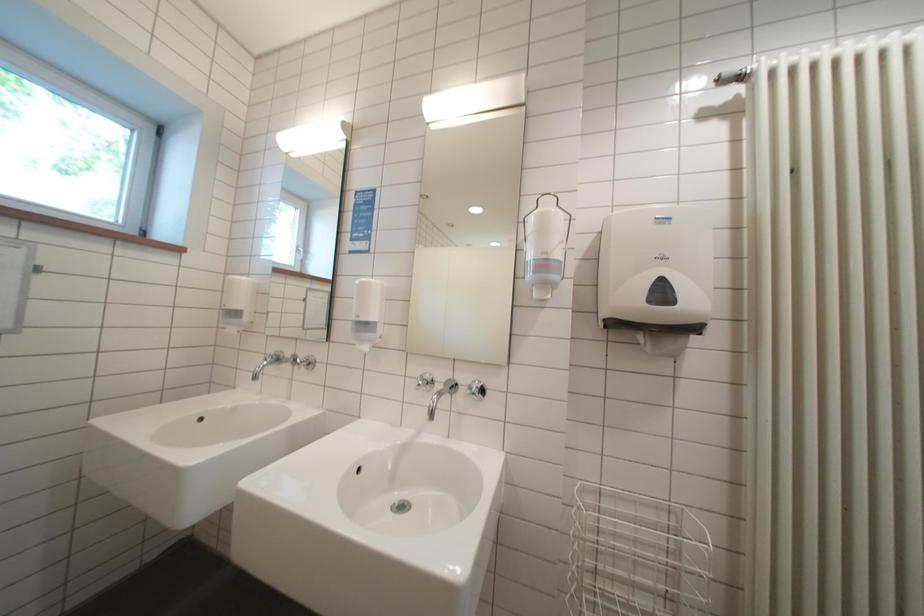
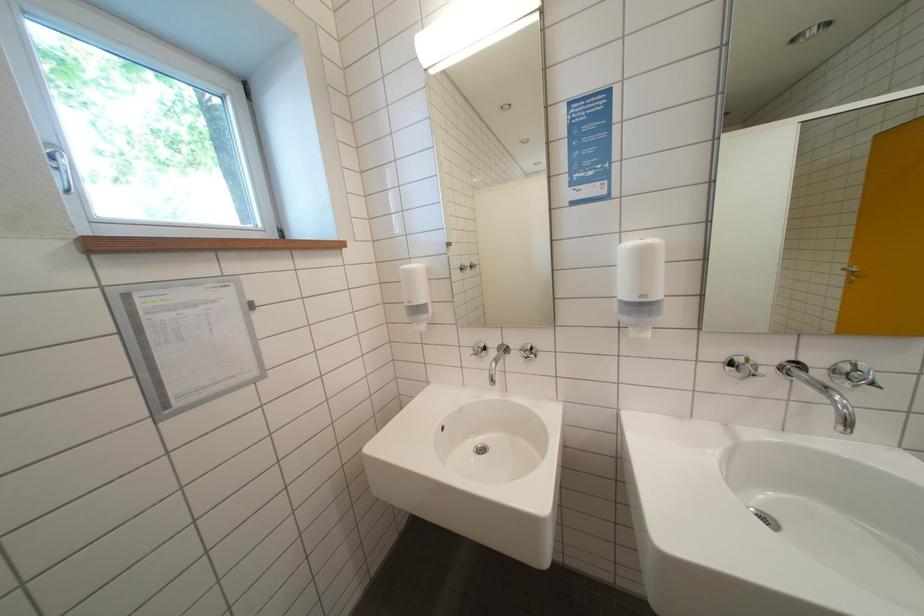
Question: In a continuous first-person perspective shot, in which direction is the camera moving?

Choices:
 (A) Left
 (B) Right
 (C) Forward
 (D) Backward

Answer: (A)